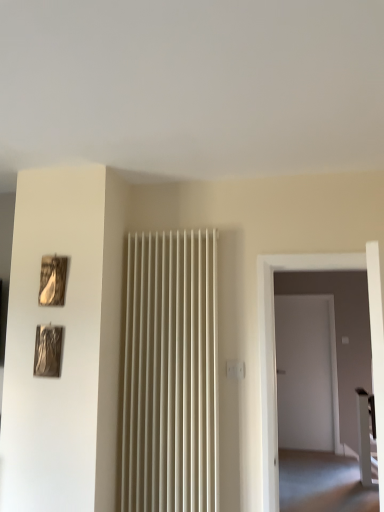
Based on the photo, measure the distance between point (368, 414) and camera.

Point (368, 414) is 11.38 feet from camera.

Where is `white glossy table at right`? The height and width of the screenshot is (512, 384). white glossy table at right is located at coordinates (366, 436).

Consider the image. In order to face metallic silver picture frame at left, which is counted as the 1th picture frame, starting from the bottom, should I rotate leftwards or rightwards?

You should rotate left by 18.540 degrees.

What are the coordinates of `wooden matte picture frame at upper left, positioned as the 2th picture frame in bottom-to-top order` in the screenshot? It's located at (52, 280).

Is wooden matte picture frame at upper left, positioned as the 2th picture frame in bottom-to-top order, positioned with its back to white glossy table at right?

wooden matte picture frame at upper left, positioned as the 2th picture frame in bottom-to-top order, is not turned away from white glossy table at right.

Find the location of `the 2nd picture frame located above the white glossy table at right (from a real-world perspective)`. the 2nd picture frame located above the white glossy table at right (from a real-world perspective) is located at coordinates (52, 280).

In terms of width, does wooden matte picture frame at upper left, positioned as the 2th picture frame in bottom-to-top order, look wider or thinner when compared to white glossy table at right?

In the image, wooden matte picture frame at upper left, positioned as the 2th picture frame in bottom-to-top order, appears to be more narrow than white glossy table at right.

From the image's perspective, is wooden matte picture frame at upper left, which is the first picture frame from top to bottom, located above metallic silver picture frame at left, which is counted as the 1th picture frame, starting from the bottom?

Yes, from the image's perspective, wooden matte picture frame at upper left, which is the first picture frame from top to bottom, is above metallic silver picture frame at left, which is counted as the 1th picture frame, starting from the bottom.

Do you think wooden matte picture frame at upper left, which is the first picture frame from top to bottom, is within metallic silver picture frame at left, marked as the second picture frame in a top-to-bottom arrangement, or outside of it?

The correct answer is: outside.

Identify the location of picture frame on the right of the metallic silver picture frame at left, marked as the second picture frame in a top-to-bottom arrangement. The width and height of the screenshot is (384, 512). (52, 280).

Is wooden matte picture frame at upper left, which is the first picture frame from top to bottom, in front of or behind metallic silver picture frame at left, marked as the second picture frame in a top-to-bottom arrangement, in the image?

wooden matte picture frame at upper left, which is the first picture frame from top to bottom, is behind metallic silver picture frame at left, marked as the second picture frame in a top-to-bottom arrangement.

Which object is wider, metallic silver picture frame at left, which is counted as the 1th picture frame, starting from the bottom, or wooden matte picture frame at upper left, positioned as the 2th picture frame in bottom-to-top order?

Wider between the two is metallic silver picture frame at left, which is counted as the 1th picture frame, starting from the bottom.

Is metallic silver picture frame at left, which is counted as the 1th picture frame, starting from the bottom, far from wooden matte picture frame at upper left, positioned as the 2th picture frame in bottom-to-top order?

That's not correct — metallic silver picture frame at left, which is counted as the 1th picture frame, starting from the bottom, is a little close to wooden matte picture frame at upper left, positioned as the 2th picture frame in bottom-to-top order.

From their relative heights in the image, would you say metallic silver picture frame at left, marked as the second picture frame in a top-to-bottom arrangement, is taller or shorter than wooden matte picture frame at upper left, which is the first picture frame from top to bottom?

metallic silver picture frame at left, marked as the second picture frame in a top-to-bottom arrangement, is taller than wooden matte picture frame at upper left, which is the first picture frame from top to bottom.

Is point (59, 350) farther from camera compared to point (57, 272)?

No, it is not.

Which point is more forward, (36, 366) or (375, 483)?

Point (36, 366)

Which object is wider, metallic silver picture frame at left, marked as the second picture frame in a top-to-bottom arrangement, or white glossy table at right?

white glossy table at right.

You are a GUI agent. You are given a task and a screenshot of the screen. Output one action in this format:
    pyautogui.click(x=<x>, y=<y>)
    Task: Click on the 2nd picture frame counting from the left of the white glossy table at right
    The height and width of the screenshot is (512, 384).
    Given the screenshot: What is the action you would take?
    pos(48,351)

Would you say metallic silver picture frame at left, marked as the second picture frame in a top-to-bottom arrangement, is outside white glossy table at right?

That's correct, metallic silver picture frame at left, marked as the second picture frame in a top-to-bottom arrangement, is outside of white glossy table at right.

Between white glossy table at right and wooden matte picture frame at upper left, positioned as the 2th picture frame in bottom-to-top order, which one has larger size?

white glossy table at right is bigger.

Considering the relative positions of white glossy table at right and wooden matte picture frame at upper left, positioned as the 2th picture frame in bottom-to-top order, in the image provided, is white glossy table at right in front of wooden matte picture frame at upper left, positioned as the 2th picture frame in bottom-to-top order,?

No, it is not.

Which is more to the right, white glossy table at right or wooden matte picture frame at upper left, which is the first picture frame from top to bottom?

white glossy table at right is more to the right.

Which of these two, white glossy table at right or wooden matte picture frame at upper left, which is the first picture frame from top to bottom, is thinner?

wooden matte picture frame at upper left, which is the first picture frame from top to bottom.

From the image's perspective, is white glossy table at right below metallic silver picture frame at left, marked as the second picture frame in a top-to-bottom arrangement?

Yes, from the image's perspective, white glossy table at right is beneath metallic silver picture frame at left, marked as the second picture frame in a top-to-bottom arrangement.

In the image, is white glossy table at right on the left side or the right side of metallic silver picture frame at left, marked as the second picture frame in a top-to-bottom arrangement?

Based on their positions, white glossy table at right is located to the right of metallic silver picture frame at left, marked as the second picture frame in a top-to-bottom arrangement.

I want to click on furniture located underneath the metallic silver picture frame at left, marked as the second picture frame in a top-to-bottom arrangement (from a real-world perspective), so point(366,436).

Based on the photo, from their relative heights in the image, would you say white glossy table at right is taller or shorter than metallic silver picture frame at left, which is counted as the 1th picture frame, starting from the bottom?

In the image, white glossy table at right appears to be taller than metallic silver picture frame at left, which is counted as the 1th picture frame, starting from the bottom.

From the image's perspective, starting from the white glossy table at right, which picture frame is the 2nd one above? Please provide its 2D coordinates.

[(52, 280)]

Where is `picture frame behind the metallic silver picture frame at left, marked as the second picture frame in a top-to-bottom arrangement`? The width and height of the screenshot is (384, 512). picture frame behind the metallic silver picture frame at left, marked as the second picture frame in a top-to-bottom arrangement is located at coordinates (52, 280).

When comparing their distances from wooden matte picture frame at upper left, positioned as the 2th picture frame in bottom-to-top order, does metallic silver picture frame at left, which is counted as the 1th picture frame, starting from the bottom, or white glossy table at right seem closer?

metallic silver picture frame at left, which is counted as the 1th picture frame, starting from the bottom, is positioned closer to the anchor wooden matte picture frame at upper left, positioned as the 2th picture frame in bottom-to-top order.

Which object lies further to the anchor point white glossy table at right, wooden matte picture frame at upper left, which is the first picture frame from top to bottom, or metallic silver picture frame at left, marked as the second picture frame in a top-to-bottom arrangement?

wooden matte picture frame at upper left, which is the first picture frame from top to bottom, is positioned further to the anchor white glossy table at right.

Which object lies further to the anchor point white glossy table at right, metallic silver picture frame at left, which is counted as the 1th picture frame, starting from the bottom, or wooden matte picture frame at upper left, which is the first picture frame from top to bottom?

The object further to white glossy table at right is wooden matte picture frame at upper left, which is the first picture frame from top to bottom.

Which object lies nearer to the anchor point metallic silver picture frame at left, marked as the second picture frame in a top-to-bottom arrangement, white glossy table at right or wooden matte picture frame at upper left, which is the first picture frame from top to bottom?

wooden matte picture frame at upper left, which is the first picture frame from top to bottom, is closer to metallic silver picture frame at left, marked as the second picture frame in a top-to-bottom arrangement.

In the scene shown: Looking at the image, which one is located closer to wooden matte picture frame at upper left, which is the first picture frame from top to bottom, white glossy table at right or metallic silver picture frame at left, which is counted as the 1th picture frame, starting from the bottom?

The object closer to wooden matte picture frame at upper left, which is the first picture frame from top to bottom, is metallic silver picture frame at left, which is counted as the 1th picture frame, starting from the bottom.

Based on their spatial positions, is wooden matte picture frame at upper left, positioned as the 2th picture frame in bottom-to-top order, or white glossy table at right further from metallic silver picture frame at left, which is counted as the 1th picture frame, starting from the bottom?

Among the two, white glossy table at right is located further to metallic silver picture frame at left, which is counted as the 1th picture frame, starting from the bottom.

Find the location of a particular element. The height and width of the screenshot is (512, 384). picture frame between metallic silver picture frame at left, marked as the second picture frame in a top-to-bottom arrangement, and white glossy table at right, in the horizontal direction is located at coordinates (52, 280).